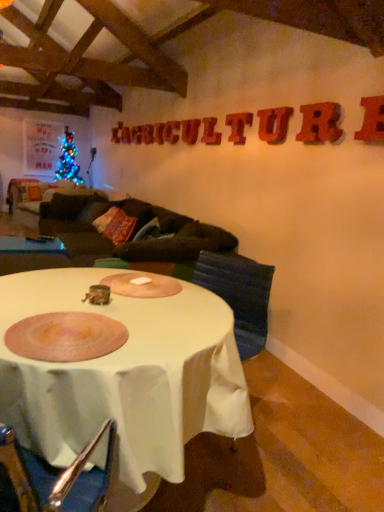
Question: Is matte red letter at upper center, arranged as the 2th letter when viewed from the back, oriented towards white cloth-covered table at center, placed as the first table when sorted from front to back?

Choices:
 (A) yes
 (B) no

Answer: (B)

Question: Does matte red letter at upper center, positioned as the eighth letter in front-to-back order, lie in front of white cloth-covered table at center, placed as the first table when sorted from front to back?

Choices:
 (A) no
 (B) yes

Answer: (A)

Question: Is matte red letter at upper center, positioned as the eighth letter in front-to-back order, surrounding white cloth-covered table at center, placed as the 1th table when sorted from bottom to top?

Choices:
 (A) yes
 (B) no

Answer: (B)

Question: Is matte red letter at upper center, positioned as the eighth letter in front-to-back order, smaller than white cloth-covered table at center, which ranks as the 2th table in top-to-bottom order?

Choices:
 (A) yes
 (B) no

Answer: (A)

Question: Is matte red letter at upper center, positioned as the eighth letter in front-to-back order, far away from white cloth-covered table at center, positioned as the 1th table in right-to-left order?

Choices:
 (A) yes
 (B) no

Answer: (A)

Question: Is wooden textured letter at upper center, which is counted as the fourth letter, starting from the left, wider or thinner than rubberized red letter u at upper center, arranged as the third letter when viewed from the right?

Choices:
 (A) wide
 (B) thin

Answer: (B)

Question: Considering the positions of wooden textured letter at upper center, the 4th letter in the back-to-front sequence, and rubberized red letter u at upper center, the third letter viewed from the front, in the image, is wooden textured letter at upper center, the 4th letter in the back-to-front sequence, taller or shorter than rubberized red letter u at upper center, the third letter viewed from the front,?

Choices:
 (A) tall
 (B) short

Answer: (B)

Question: From the image's perspective, relative to rubberized red letter u at upper center, the 7th letter positioned from the back, is wooden textured letter at upper center, which is the 6th letter from front to back, above or below?

Choices:
 (A) below
 (B) above

Answer: (B)

Question: From a real-world perspective, is wooden textured letter at upper center, the 4th letter in the back-to-front sequence, above or below rubberized red letter u at upper center, the 7th letter positioned from the back?

Choices:
 (A) above
 (B) below

Answer: (B)

Question: In the image, is white glossy table at lower left, the first table positioned from the top, positioned in front of or behind blue fabric armchair at center?

Choices:
 (A) behind
 (B) front

Answer: (A)

Question: From a real-world perspective, is white glossy table at lower left, the second table viewed from the front, physically located above or below blue fabric armchair at center?

Choices:
 (A) below
 (B) above

Answer: (A)

Question: Looking at their shapes, would you say white glossy table at lower left, placed as the 2th table when sorted from right to left, is wider or thinner than blue fabric armchair at center?

Choices:
 (A) wide
 (B) thin

Answer: (A)

Question: Considering the positions of white glossy table at lower left, placed as the second table when sorted from bottom to top, and blue fabric armchair at center in the image, is white glossy table at lower left, placed as the second table when sorted from bottom to top, taller or shorter than blue fabric armchair at center?

Choices:
 (A) tall
 (B) short

Answer: (B)

Question: From a real-world perspective, relative to rubberized red letter at upper right, the ninth letter positioned from the back, is matte red letter at upper center, arranged as the 2th letter when viewed from the back, vertically above or below?

Choices:
 (A) above
 (B) below

Answer: (B)

Question: Considering their positions, is matte red letter at upper center, which is counted as the eighth letter, starting from the right, located in front of or behind rubberized red letter at upper right, arranged as the 1th letter when viewed from the front?

Choices:
 (A) front
 (B) behind

Answer: (B)